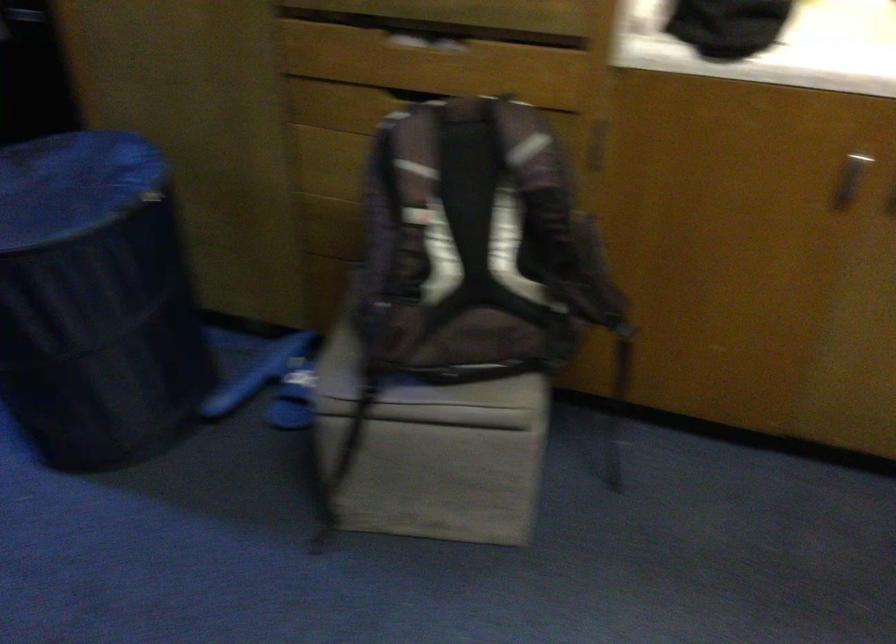
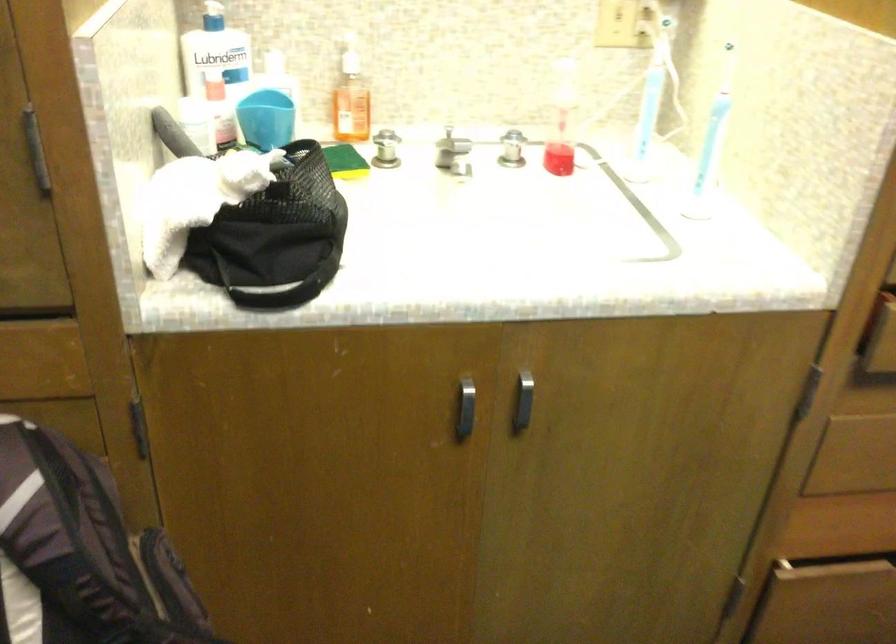
Question: The images are taken continuously from a first-person perspective. In which direction is your viewpoint rotating?

Choices:
 (A) Left
 (B) Right
 (C) Up
 (D) Down

Answer: (B)